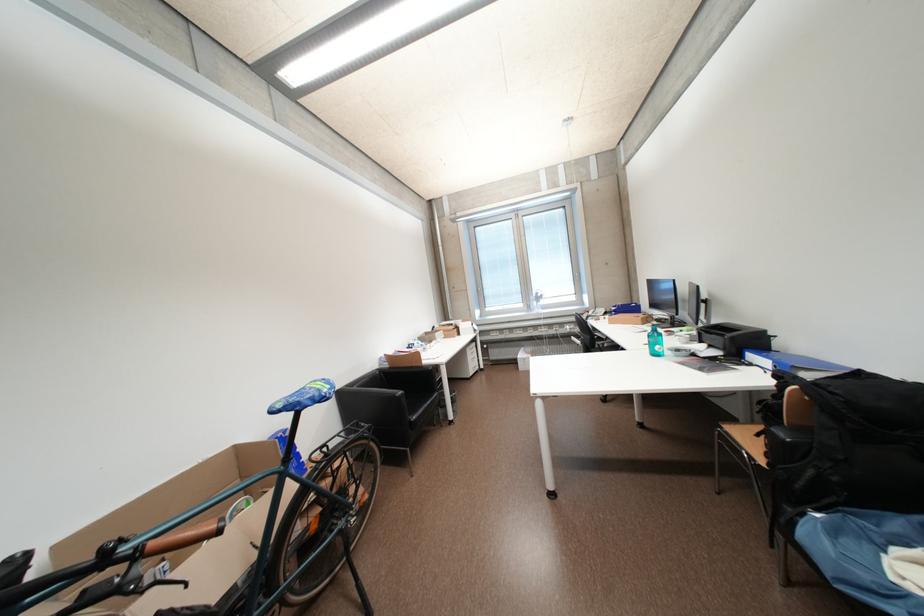
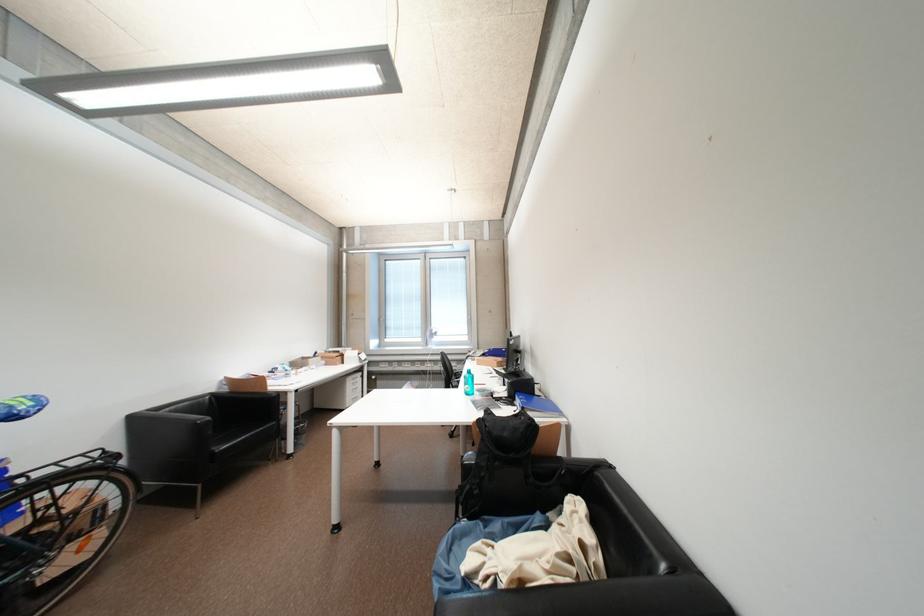
The point at (419, 424) is marked in the first image. Where is the corresponding point in the second image?

(221, 456)